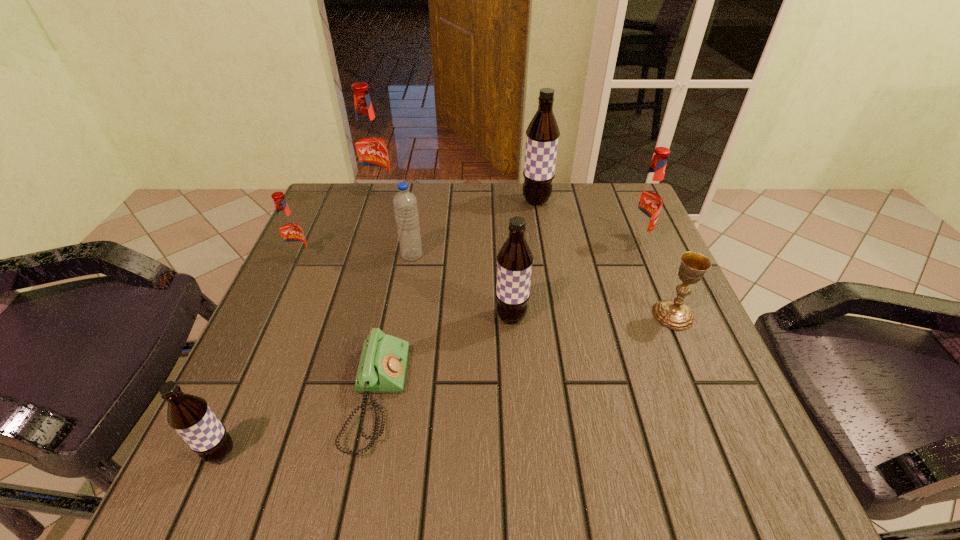
The width and height of the screenshot is (960, 540). I want to click on vacant area between the third object from right to left and the chalice, so click(x=605, y=258).

You are a GUI agent. You are given a task and a screenshot of the screen. Output one action in this format:
    pyautogui.click(x=<x>, y=<y>)
    Task: Click on the blank region between the farthest brown root beer and the water bottle
    
    Given the screenshot: What is the action you would take?
    pyautogui.click(x=474, y=228)

Where is `vacant area between the rightmost brown root beer and the second red root beer from left to right`? This screenshot has width=960, height=540. vacant area between the rightmost brown root beer and the second red root beer from left to right is located at coordinates (457, 197).

Find the location of a particular element. Image resolution: width=960 pixels, height=540 pixels. free space between the fourth nearest root beer and the leftmost red root beer is located at coordinates (468, 249).

This screenshot has height=540, width=960. In order to click on vacant point located between the fourth root beer from left to right and the shortest object in this screenshot , I will do `click(444, 356)`.

Identify the location of object that is the sixth closest to the sixth object from left to right. (290, 232).

You are a GUI agent. You are given a task and a screenshot of the screen. Output one action in this format:
    pyautogui.click(x=<x>, y=<y>)
    Task: Click on the fourth closest object to the water bottle
    The width and height of the screenshot is (960, 540).
    Given the screenshot: What is the action you would take?
    pyautogui.click(x=382, y=367)

Identify which root beer is the closest to the shortest object. Please provide its 2D coordinates. Your answer should be formatted as a tuple, i.e. [(x, y)], where the tuple contains the x and y coordinates of a point satisfying the conditions above.

[(190, 416)]

Point out which root beer is positioned as the fourth nearest to the water bottle. Please provide its 2D coordinates. Your answer should be formatted as a tuple, i.e. [(x, y)], where the tuple contains the x and y coordinates of a point satisfying the conditions above.

[(542, 135)]

Locate which brown root beer ranks second in proximity to the second biggest brown root beer. Please provide its 2D coordinates. Your answer should be formatted as a tuple, i.e. [(x, y)], where the tuple contains the x and y coordinates of a point satisfying the conditions above.

[(190, 416)]